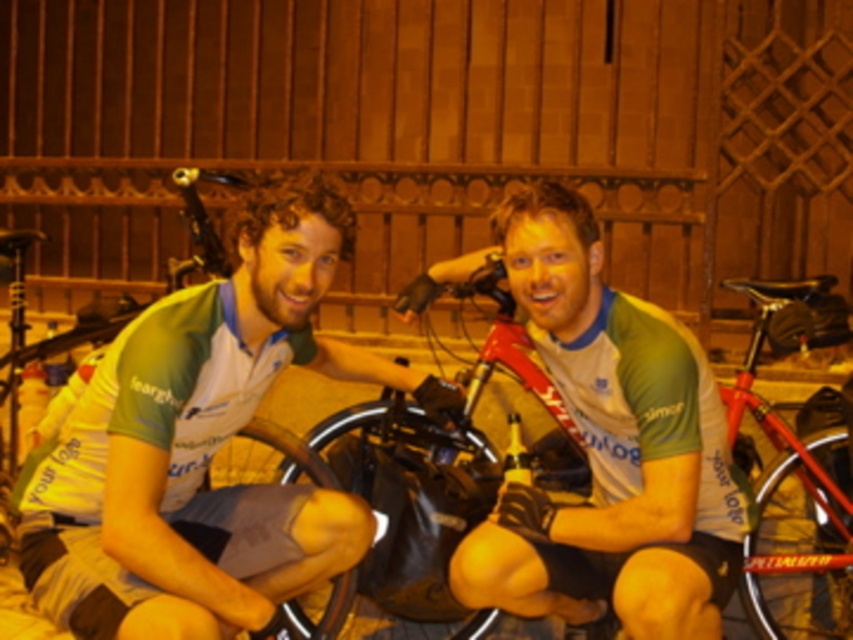
Question: Which point is farther to the camera?

Choices:
 (A) (355, 404)
 (B) (74, 582)

Answer: (A)

Question: Is green jersey at center smaller than red matte bicycle at center?

Choices:
 (A) yes
 (B) no

Answer: (B)

Question: Is green jersey at center to the left of red matte bicycle at center from the viewer's perspective?

Choices:
 (A) yes
 (B) no

Answer: (A)

Question: Which of the following is the farthest from the observer?

Choices:
 (A) red matte bicycle at center
 (B) green jersey at center

Answer: (A)

Question: Can you confirm if green jersey at center is positioned to the left of red matte bicycle at center?

Choices:
 (A) no
 (B) yes

Answer: (B)